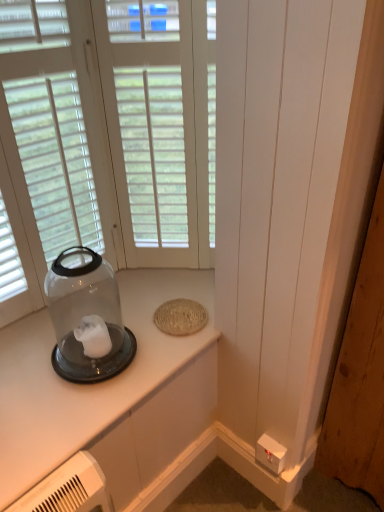
This screenshot has width=384, height=512. Identify the location of free space to the left of transparent glass jar at left. (29, 353).